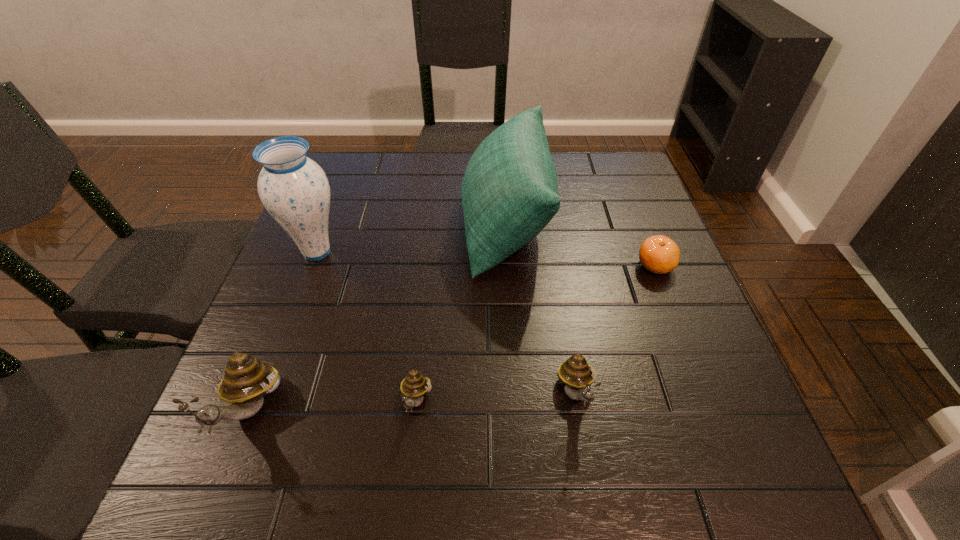
Please point out where to position a new snail on the right to maintain spacing. Please provide its 2D coordinates. Your answer should be formatted as a tuple, i.e. [(x, y)], where the tuple contains the x and y coordinates of a point satisfying the conditions above.

[(732, 386)]